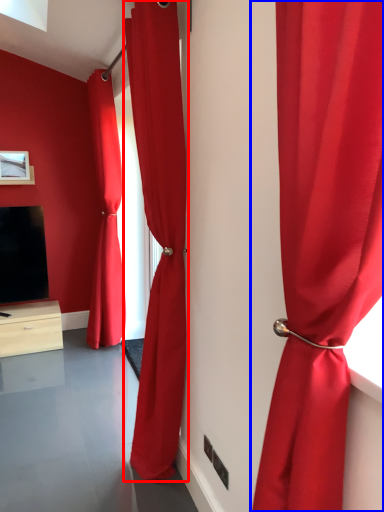
Question: Which object is closer to the camera taking this photo, curtain (highlighted by a red box) or curtain (highlighted by a blue box)?

Choices:
 (A) curtain
 (B) curtain

Answer: (B)